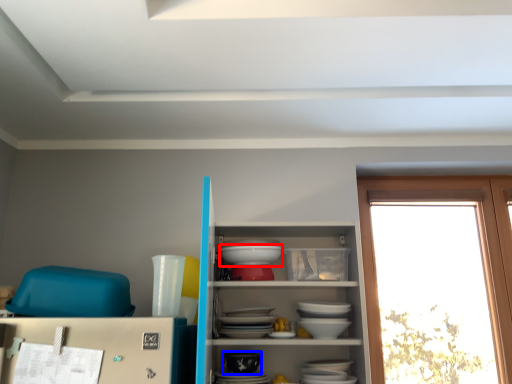
Question: Which object appears farthest to the camera in this image, table (highlighted by a red box) or tableware (highlighted by a blue box)?

Choices:
 (A) table
 (B) tableware

Answer: (A)